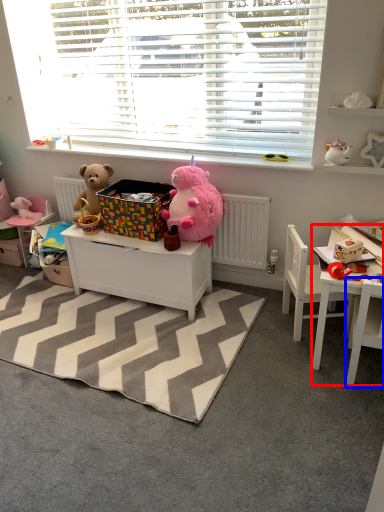
Question: Among these objects, which one is farthest to the camera, table (highlighted by a red box) or chair (highlighted by a blue box)?

Choices:
 (A) table
 (B) chair

Answer: (A)